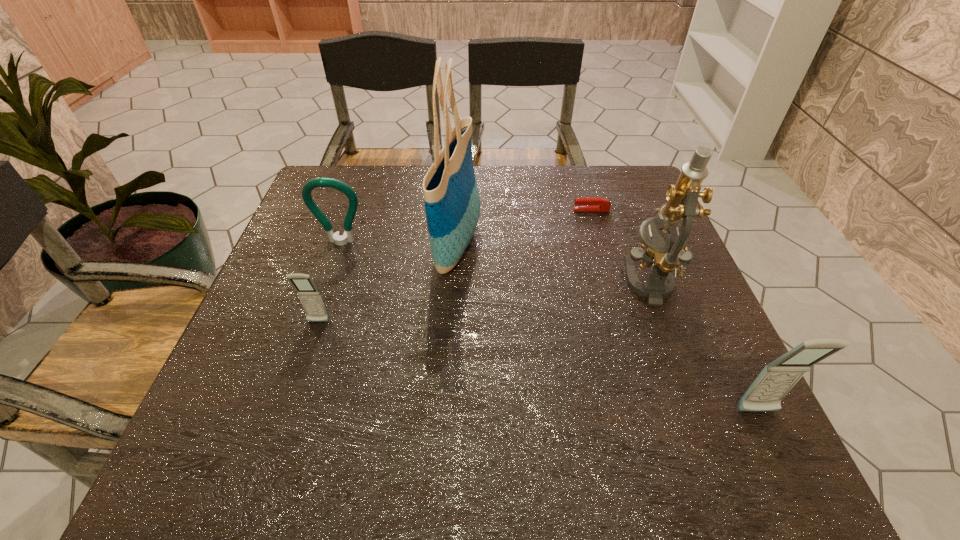
The width and height of the screenshot is (960, 540). Identify the location of location for an additional cellular_telephone to make spacing equal. (519, 363).